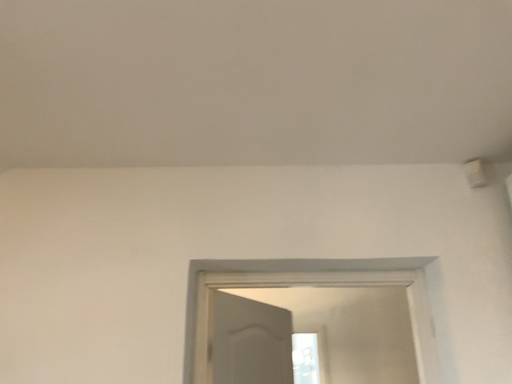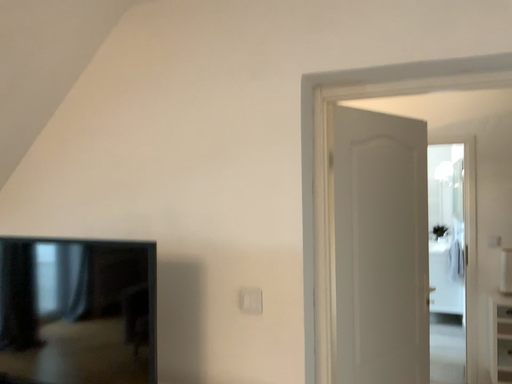
Question: How did the camera likely rotate when shooting the video?

Choices:
 (A) rotated left
 (B) rotated right

Answer: (A)